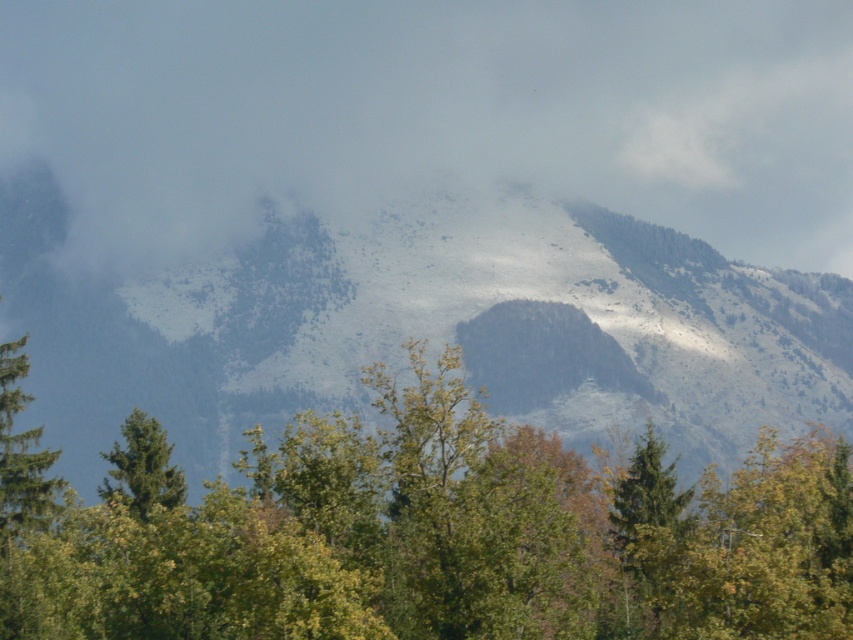
Can you confirm if white fluffy cloud at upper center is smaller than green leafy tree at center?

Actually, white fluffy cloud at upper center might be larger than green leafy tree at center.

Can you confirm if white fluffy cloud at upper center is positioned to the right of green leafy tree at center?

Yes, white fluffy cloud at upper center is to the right of green leafy tree at center.

Where is `white fluffy cloud at upper center`? This screenshot has width=853, height=640. white fluffy cloud at upper center is located at coordinates (434, 115).

Which is below, snowy rocky mountain at upper center or green matte tree at left?

green matte tree at left is lower down.

Between point (447, 237) and point (28, 456), which one is positioned in front?

Point (28, 456) is more forward.

The height and width of the screenshot is (640, 853). Identify the location of snowy rocky mountain at upper center. (427, 326).

Is green leafy tree at center wider than green matte tree at lower left?

Indeed, green leafy tree at center has a greater width compared to green matte tree at lower left.

Does green leafy tree at center have a smaller size compared to green matte tree at lower left?

No.

This screenshot has width=853, height=640. I want to click on green leafy tree at center, so click(437, 536).